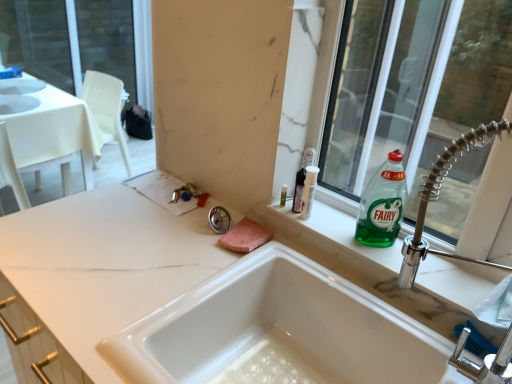
Question: Is white marble countertop at center smaller than white glossy sink at center?

Choices:
 (A) no
 (B) yes

Answer: (A)

Question: Is white glossy sink at center located within white marble countertop at center?

Choices:
 (A) no
 (B) yes

Answer: (B)

Question: Does white marble countertop at center lie in front of white glossy sink at center?

Choices:
 (A) no
 (B) yes

Answer: (B)

Question: Is white marble countertop at center to the right of white glossy sink at center from the viewer's perspective?

Choices:
 (A) yes
 (B) no

Answer: (B)

Question: From a real-world perspective, is white marble countertop at center positioned over white glossy sink at center based on gravity?

Choices:
 (A) yes
 (B) no

Answer: (B)

Question: Is white marble countertop at center wider than white glossy sink at center?

Choices:
 (A) no
 (B) yes

Answer: (B)

Question: Is green glass bottle at upper right completely or partially outside of translucent plastic bottle at upper right?

Choices:
 (A) no
 (B) yes

Answer: (B)

Question: Is there a large distance between green glass bottle at upper right and translucent plastic bottle at upper right?

Choices:
 (A) no
 (B) yes

Answer: (A)

Question: Considering the relative sizes of green glass bottle at upper right and translucent plastic bottle at upper right in the image provided, is green glass bottle at upper right thinner than translucent plastic bottle at upper right?

Choices:
 (A) no
 (B) yes

Answer: (B)

Question: Does green glass bottle at upper right have a larger size compared to translucent plastic bottle at upper right?

Choices:
 (A) no
 (B) yes

Answer: (B)

Question: Can you confirm if green glass bottle at upper right is positioned to the left of translucent plastic bottle at upper right?

Choices:
 (A) yes
 (B) no

Answer: (B)

Question: Could you tell me if green glass bottle at upper right is facing translucent plastic bottle at upper right?

Choices:
 (A) yes
 (B) no

Answer: (B)

Question: Are transparent glass window at upper right and green glass bottle at upper right located far from each other?

Choices:
 (A) no
 (B) yes

Answer: (A)